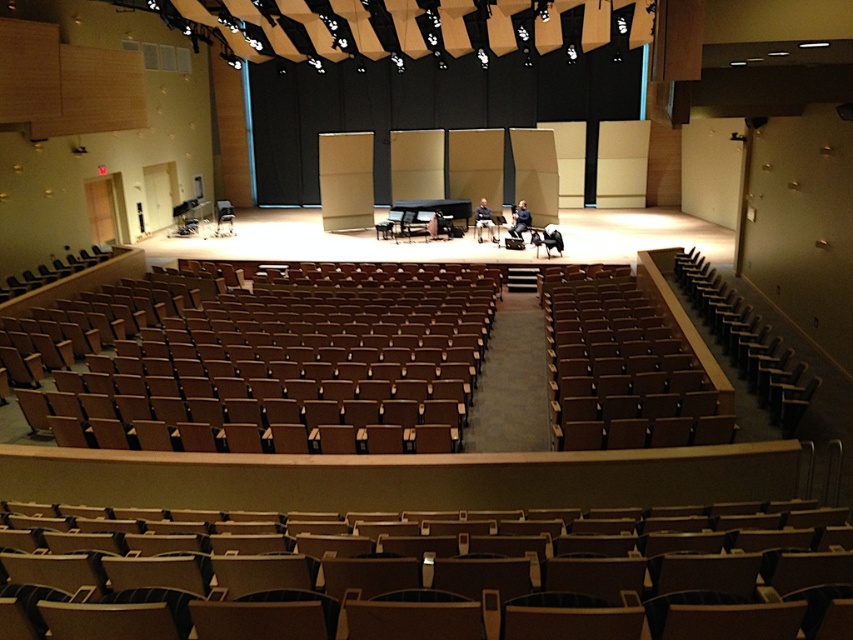
Who is shorter, wooden seat at center or brown wood chair at center?

With less height is wooden seat at center.

Does wooden seat at center come behind brown wood chair at center?

No, it is in front of brown wood chair at center.

Which is in front, point (837, 513) or point (666, 355)?

Point (837, 513) is more forward.

You are a GUI agent. You are given a task and a screenshot of the screen. Output one action in this format:
    pyautogui.click(x=<x>, y=<y>)
    Task: Click on the wooden seat at center
    The image size is (853, 640).
    Given the screenshot: What is the action you would take?
    pyautogui.click(x=437, y=576)

Does point (724, 422) come farther from viewer compared to point (759, 330)?

That is False.

Is brown wood chair at center thinner than brown leather chair at right?

In fact, brown wood chair at center might be wider than brown leather chair at right.

The image size is (853, 640). Identify the location of brown wood chair at center. (625, 371).

Can you confirm if wooden seat at center is bigger than brown leather chair at right?

Correct, wooden seat at center is larger in size than brown leather chair at right.

Measure the distance from wooden seat at center to brown leather chair at right.

wooden seat at center and brown leather chair at right are 5.78 meters apart from each other.

What do you see at coordinates (437, 576) in the screenshot? I see `wooden seat at center` at bounding box center [437, 576].

Where is `wooden seat at center`? This screenshot has width=853, height=640. wooden seat at center is located at coordinates (437, 576).